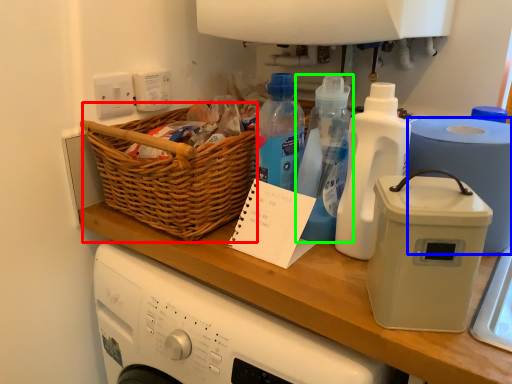
Question: Which object is positioned farthest from basket (highlighted by a red box)? Select from paper towel (highlighted by a blue box) and bottle (highlighted by a green box).

Choices:
 (A) paper towel
 (B) bottle

Answer: (A)